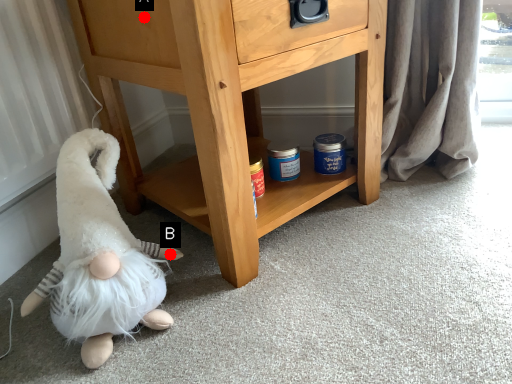
Question: Two points are circled on the image, labeled by A and B beside each circle. Among these points, which one is nearest to the camera?

Choices:
 (A) A is closer
 (B) B is closer

Answer: (A)